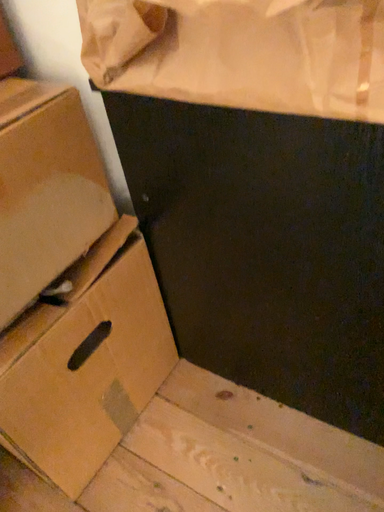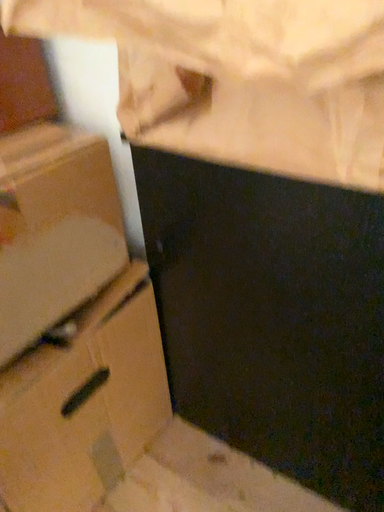
Question: How did the camera likely rotate when shooting the video?

Choices:
 (A) rotated upward
 (B) rotated downward

Answer: (A)